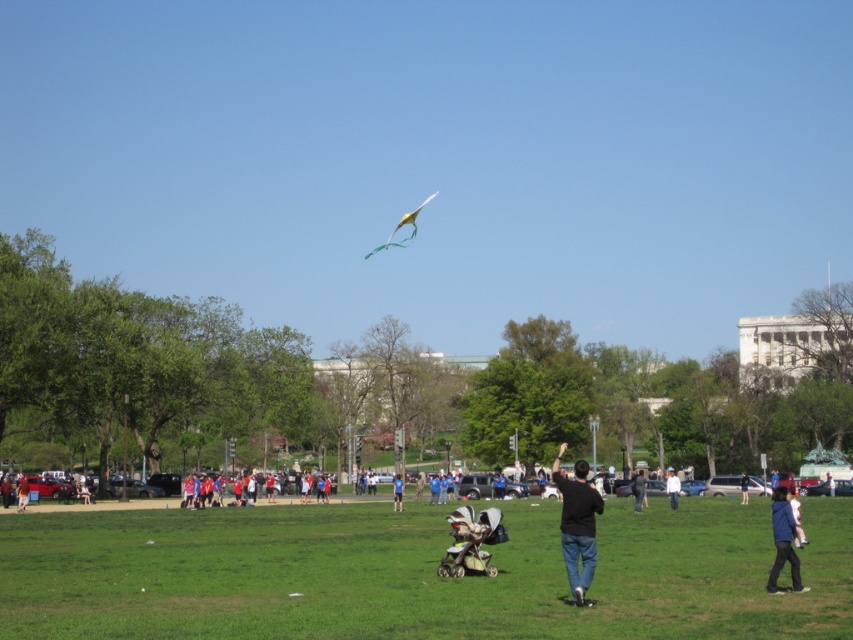
Between point (677, 492) and point (22, 508), which one is positioned behind?

The point (22, 508) is behind.

Is white matte shirt at center taller than red shirt at lower left?

Indeed, white matte shirt at center has a greater height compared to red shirt at lower left.

The width and height of the screenshot is (853, 640). What do you see at coordinates (672, 486) in the screenshot? I see `white matte shirt at center` at bounding box center [672, 486].

At what (x,y) coordinates should I click in order to perform the action: click on white matte shirt at center. Please return your answer as a coordinate pair (x, y). The height and width of the screenshot is (640, 853). Looking at the image, I should click on (672, 486).

Who is shorter, solid red shirt at center or black cotton jacket at center?

solid red shirt at center

Who is positioned more to the left, solid red shirt at center or black cotton jacket at center?

solid red shirt at center

Is point (210, 481) farther from viewer compared to point (631, 492)?

No, it is not.

Locate an element on the screen. This screenshot has height=640, width=853. solid red shirt at center is located at coordinates (241, 493).

Does blue fabric jacket at lower right have a lesser width compared to solid red shirt at center?

Correct, blue fabric jacket at lower right's width is less than solid red shirt at center's.

Between blue fabric jacket at lower right and solid red shirt at center, which one has less height?

Standing shorter between the two is solid red shirt at center.

The image size is (853, 640). Describe the element at coordinates (782, 541) in the screenshot. I see `blue fabric jacket at lower right` at that location.

The image size is (853, 640). Identify the location of blue fabric jacket at lower right. (782, 541).